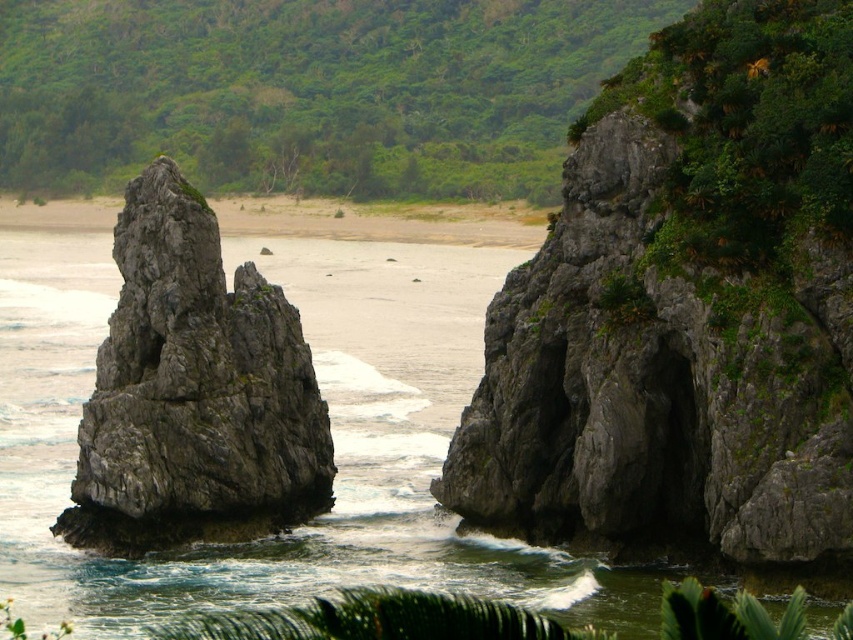
Question: Which of the following is the closest to the observer?

Choices:
 (A) gray rough rock at left
 (B) gray rock at center
 (C) gray rough rock at right
 (D) greenish water at center

Answer: (C)

Question: Can you confirm if green leafy vegetation at upper center is positioned to the right of gray rough rock at left?

Choices:
 (A) no
 (B) yes

Answer: (A)

Question: Among these points, which one is farthest from the camera?

Choices:
 (A) (550, 404)
 (B) (13, 42)
 (C) (416, 333)

Answer: (B)

Question: Can you confirm if green leafy vegetation at upper center is positioned to the right of gray rock at center?

Choices:
 (A) yes
 (B) no

Answer: (B)

Question: Which point is closer to the camera?

Choices:
 (A) (134, 520)
 (B) (828, 605)
 (C) (77, 221)

Answer: (B)

Question: Where is greenish water at center located in relation to gray rock at center in the image?

Choices:
 (A) left
 (B) right

Answer: (B)